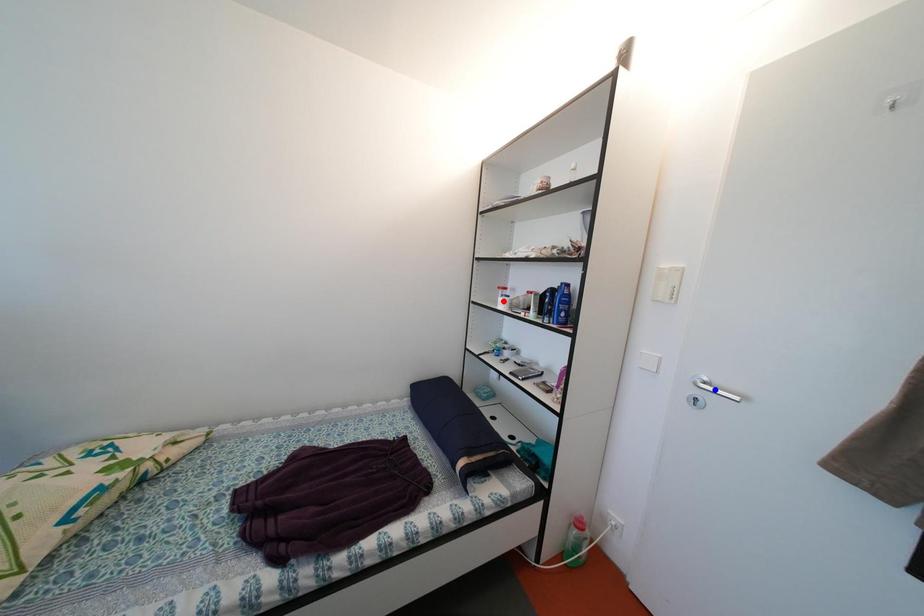
Question: In the image, two points are highlighted. Which point is nearer to the camera? Reply with the corresponding letter.

Choices:
 (A) blue point
 (B) red point

Answer: (A)